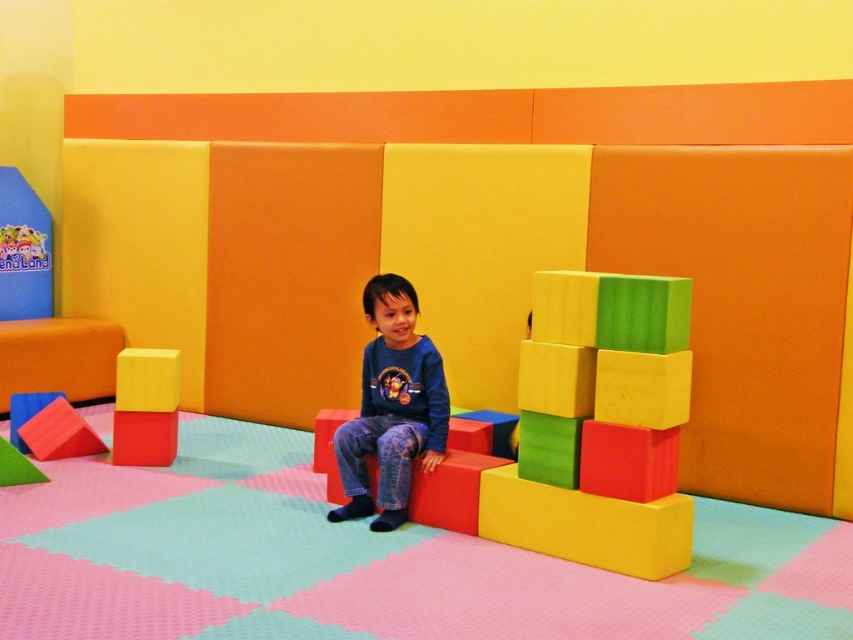
Which is behind, point (570, 525) or point (51, 444)?

Point (51, 444)

Locate an element on the screen. rubber foam blocks at center is located at coordinates (596, 432).

Measure the distance between point (364, 312) and camera.

Point (364, 312) is 13.35 feet away from camera.

Consider the image. Does blue cotton shirt at center have a greater height compared to matte yellow foam block at center?

Yes, blue cotton shirt at center is taller than matte yellow foam block at center.

Between point (413, 419) and point (129, 369), which one is positioned behind?

Point (129, 369)

Locate an element on the screen. blue cotton shirt at center is located at coordinates (392, 406).

Who is taller, rubber foam blocks at center or matte yellow foam block at center?

Standing taller between the two is rubber foam blocks at center.

In order to click on rubber foam blocks at center in this screenshot , I will do `click(596, 432)`.

At what (x,y) coordinates should I click in order to perform the action: click on rubber foam blocks at center. Please return your answer as a coordinate pair (x, y). The image size is (853, 640). Looking at the image, I should click on (596, 432).